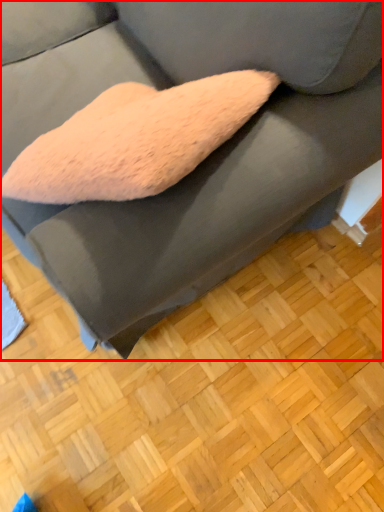
Question: From the image's perspective, where is studio couch (annotated by the red box) located in relation to hardwood in the image?

Choices:
 (A) above
 (B) below

Answer: (A)